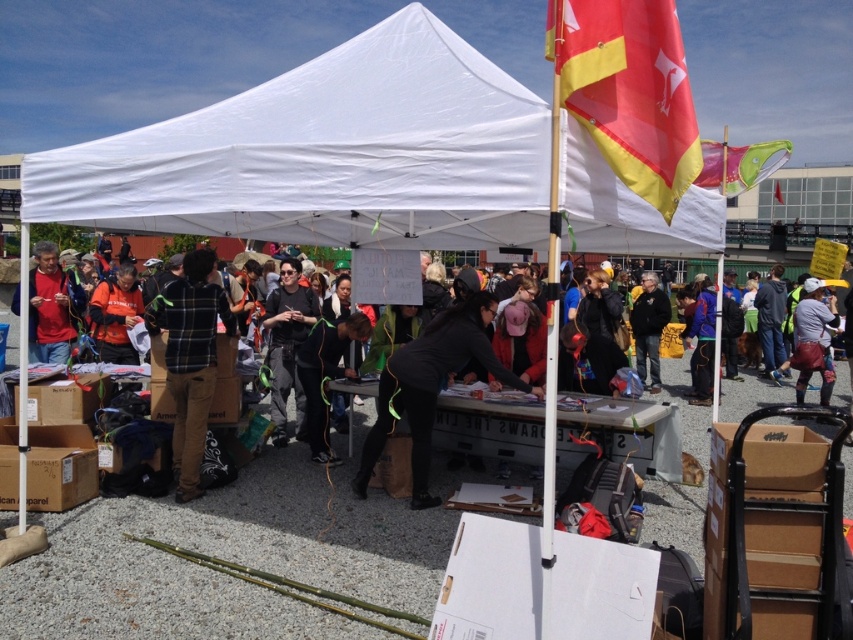
Question: Is white fabric canopy at upper center positioned at the back of matte black jacket at center?

Choices:
 (A) yes
 (B) no

Answer: (B)

Question: Which of the following is the closest to the observer?

Choices:
 (A) matte red shirt at left
 (B) dark gray hoodie at center
 (C) white fabric canopy at upper center

Answer: (C)

Question: Is red/yellow fabric flag at upper right positioned in front of matte black jacket at center?

Choices:
 (A) yes
 (B) no

Answer: (A)

Question: Which object appears farthest from the camera in this image?

Choices:
 (A) white fabric canopy at upper center
 (B) red/yellow fabric flag at upper right

Answer: (A)

Question: Does green fabric kite at upper right appear over dark gray hoodie at center?

Choices:
 (A) no
 (B) yes

Answer: (B)

Question: Which object is positioned closest to the leather bag at right?

Choices:
 (A) matte red shirt at left
 (B) matte black jacket at center
 (C) green fabric kite at upper right

Answer: (C)